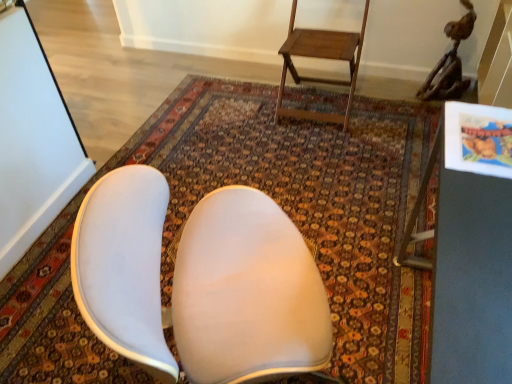
Image resolution: width=512 pixels, height=384 pixels. What are the coordinates of `wooden step stool at upper center` in the screenshot? It's located at (323, 58).

At what (x,y) coordinates should I click in order to perform the action: click on metallic gray table at right. Please return your answer as a coordinate pair (x, y). This screenshot has width=512, height=384. Looking at the image, I should click on (474, 248).

Can you confirm if carpeted rug at center is smaller than wooden step stool at upper center?

Indeed, carpeted rug at center has a smaller size compared to wooden step stool at upper center.

From a real-world perspective, is carpeted rug at center above or below wooden step stool at upper center?

carpeted rug at center is situated lower than wooden step stool at upper center in the real world.

Considering the relative sizes of carpeted rug at center and wooden step stool at upper center in the image provided, is carpeted rug at center shorter than wooden step stool at upper center?

Correct, carpeted rug at center is not as tall as wooden step stool at upper center.

Considering the sizes of objects metallic gray table at right and wooden step stool at upper center in the image provided, who is wider, metallic gray table at right or wooden step stool at upper center?

wooden step stool at upper center.

Measure the distance from metallic gray table at right to wooden step stool at upper center.

metallic gray table at right and wooden step stool at upper center are 1.36 meters apart.

From the picture: Which object is closer to the camera taking this photo, metallic gray table at right or wooden step stool at upper center?

metallic gray table at right is in front.

Is metallic gray table at right not close to wooden step stool at upper center?

Yes.

From the picture: Is carpeted rug at center located outside metallic gray table at right?

That's correct, carpeted rug at center is outside of metallic gray table at right.

From the image's perspective, between carpeted rug at center and metallic gray table at right, who is located below?

From the image's view, metallic gray table at right is below.

Who is shorter, carpeted rug at center or metallic gray table at right?

Standing shorter between the two is carpeted rug at center.

The width and height of the screenshot is (512, 384). In order to click on mat lying on the left of metallic gray table at right in this screenshot , I will do `click(279, 204)`.

Locate an element on the screen. This screenshot has width=512, height=384. table located in front of the carpeted rug at center is located at coordinates (474, 248).

Is carpeted rug at center a part of metallic gray table at right?

No.

Are metallic gray table at right and carpeted rug at center far apart?

metallic gray table at right is positioned a significant distance from carpeted rug at center.

Is metallic gray table at right facing towards carpeted rug at center?

Yes.

Can you confirm if wooden step stool at upper center is thinner than carpeted rug at center?

Yes, wooden step stool at upper center is thinner than carpeted rug at center.

From the image's perspective, which is above, wooden step stool at upper center or carpeted rug at center?

wooden step stool at upper center appears higher in the image.

From a real-world perspective, which is physically below, wooden step stool at upper center or carpeted rug at center?

carpeted rug at center, from a real-world perspective.

Which object is positioned more to the left, wooden step stool at upper center or metallic gray table at right?

Positioned to the left is wooden step stool at upper center.

Is wooden step stool at upper center facing towards metallic gray table at right?

No, wooden step stool at upper center is not aimed at metallic gray table at right.

Can you confirm if wooden step stool at upper center is bigger than metallic gray table at right?

Incorrect, wooden step stool at upper center is not larger than metallic gray table at right.

You are a GUI agent. You are given a task and a screenshot of the screen. Output one action in this format:
    pyautogui.click(x=<x>, y=<y>)
    Task: Click on the chair behind the carpeted rug at center
    The image size is (512, 384).
    Given the screenshot: What is the action you would take?
    pyautogui.click(x=323, y=58)

Locate an element on the screen. table on the right of wooden step stool at upper center is located at coordinates (474, 248).

Which object lies further to the anchor point wooden step stool at upper center, carpeted rug at center or metallic gray table at right?

The object further to wooden step stool at upper center is metallic gray table at right.

From the image, which object appears to be farther from carpeted rug at center, metallic gray table at right or wooden step stool at upper center?

metallic gray table at right is positioned further to the anchor carpeted rug at center.

From the image, which object appears to be nearer to wooden step stool at upper center, metallic gray table at right or carpeted rug at center?

Among the two, carpeted rug at center is located nearer to wooden step stool at upper center.

From the image, which object appears to be farther from metallic gray table at right, wooden step stool at upper center or carpeted rug at center?

wooden step stool at upper center lies further to metallic gray table at right than the other object.

From the image, which object appears to be nearer to metallic gray table at right, carpeted rug at center or wooden step stool at upper center?

Based on the image, carpeted rug at center appears to be nearer to metallic gray table at right.

When comparing their distances from carpeted rug at center, does wooden step stool at upper center or metallic gray table at right seem closer?

Based on the image, wooden step stool at upper center appears to be nearer to carpeted rug at center.

I want to click on mat between metallic gray table at right and wooden step stool at upper center in the front-back direction, so click(x=279, y=204).